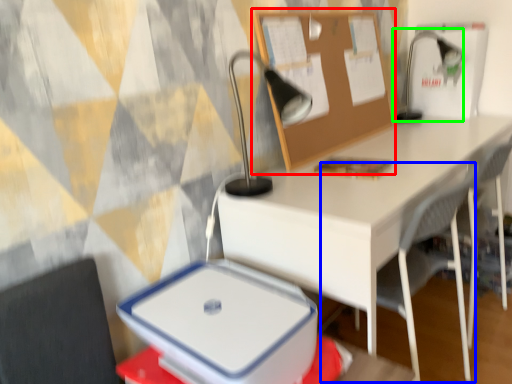
Question: Considering the real-world distances, which object is closest to bulletin board (highlighted by a red box)? armchair (highlighted by a blue box) or table lamp (highlighted by a green box).

Choices:
 (A) armchair
 (B) table lamp

Answer: (A)